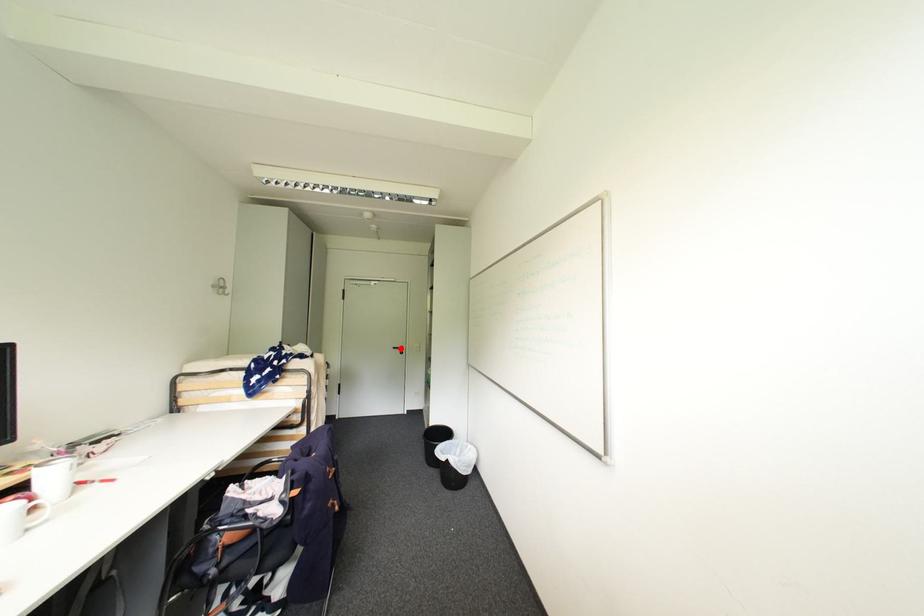
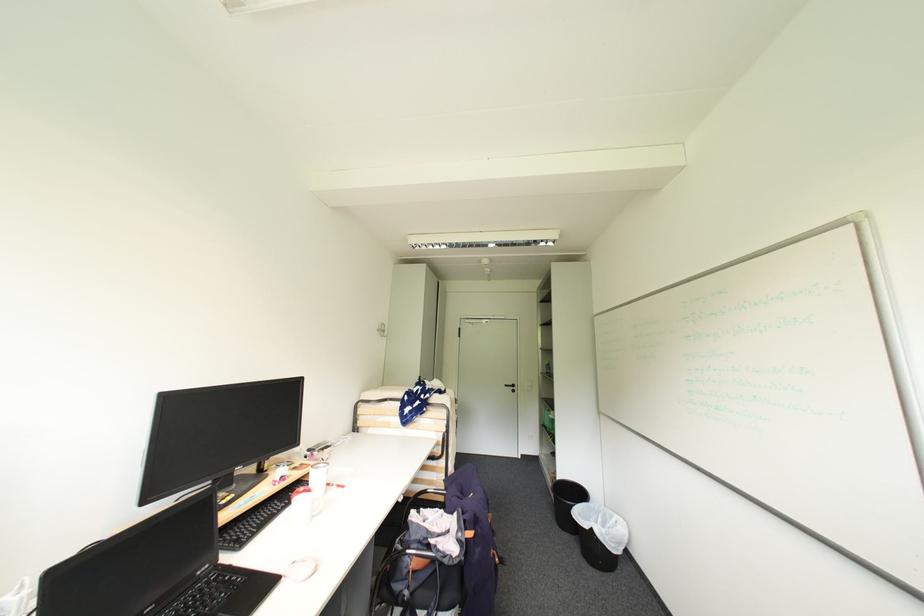
In the second image, find the point that corresponds to the highlighted location in the first image.

(513, 387)